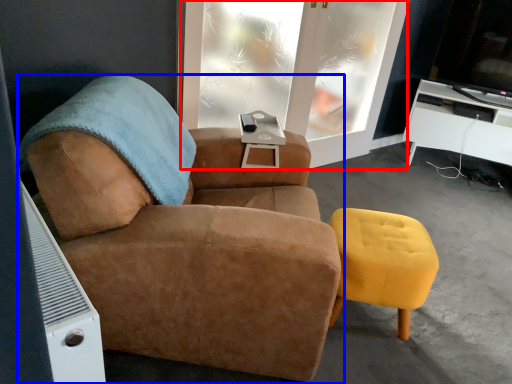
Question: Which point is closer to the camera, screen door (highlighted by a red box) or chair (highlighted by a blue box)?

Choices:
 (A) screen door
 (B) chair

Answer: (B)